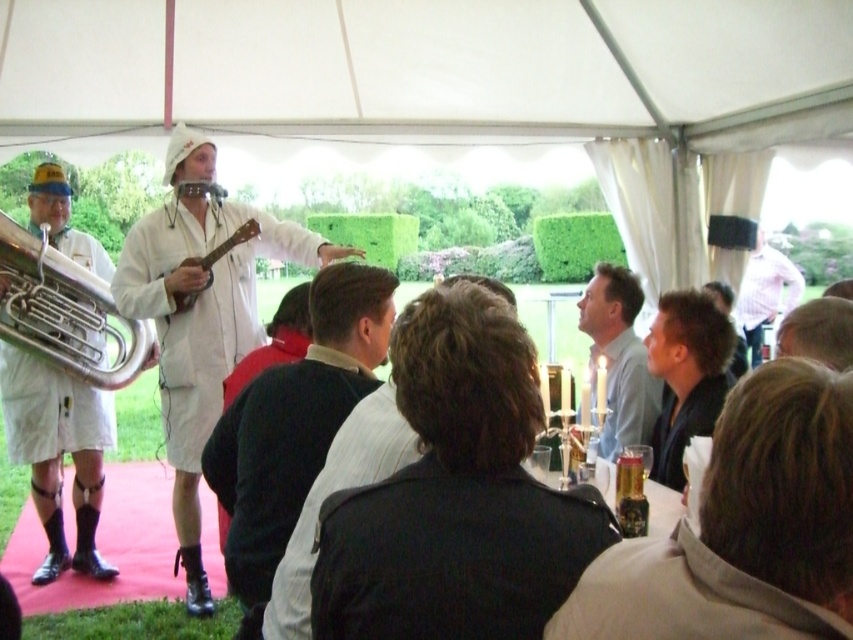
Question: In this image, where is white matte coat at center located relative to brass polished trumpet at left?

Choices:
 (A) above
 (B) below

Answer: (B)

Question: Based on their relative distances, which object is nearer to the light blue shirt at center?

Choices:
 (A) dark brown leather jacket at center
 (B) matte white ukulele at center

Answer: (A)

Question: Which object is the farthest from the dark brown leather jacket at center?

Choices:
 (A) white matte coat at center
 (B) pink cotton shirt at upper right
 (C) silver polished tuba at left

Answer: (B)

Question: Is dark brown leather jacket at center positioned at the back of light blue shirt at center?

Choices:
 (A) no
 (B) yes

Answer: (A)

Question: Is white matte coat at center below dark brown leather jacket at center?

Choices:
 (A) yes
 (B) no

Answer: (B)

Question: Which object appears farthest from the camera in this image?

Choices:
 (A) white matte coat at center
 (B) light blue shirt at center
 (C) silver polished tuba at left

Answer: (C)